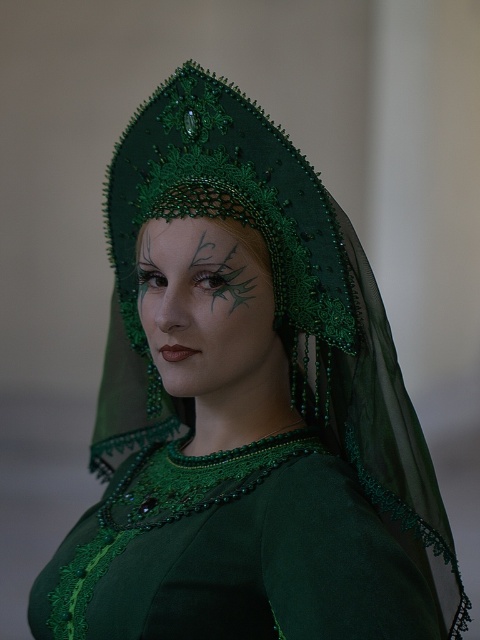
Question: Which of the following is the closest to the observer?

Choices:
 (A) (193, 253)
 (B) (202, 276)
 (C) (157, 221)
 (D) (194, 220)

Answer: (A)

Question: Is matte green face at center bigger than green matte/embroidered eyebrow at upper center?

Choices:
 (A) yes
 (B) no

Answer: (A)

Question: Is matte green fabric at center to the right of green matte eyebrow at upper center from the viewer's perspective?

Choices:
 (A) yes
 (B) no

Answer: (B)

Question: Which of these objects is positioned closest to the green matte eyebrow at upper center?

Choices:
 (A) matte green fabric at center
 (B) green matte/embroidered eyebrow at upper center
 (C) matte green face at center

Answer: (A)

Question: Which point is farther to the camera?

Choices:
 (A) green matte/embroidered eyebrow at upper center
 (B) matte green face at center
 (C) matte green fabric at center
 (D) green matte eyebrow at upper center

Answer: (A)

Question: Where is green matte eyebrow at upper center located in relation to green matte/embroidered eyebrow at upper center in the image?

Choices:
 (A) above
 (B) below

Answer: (B)